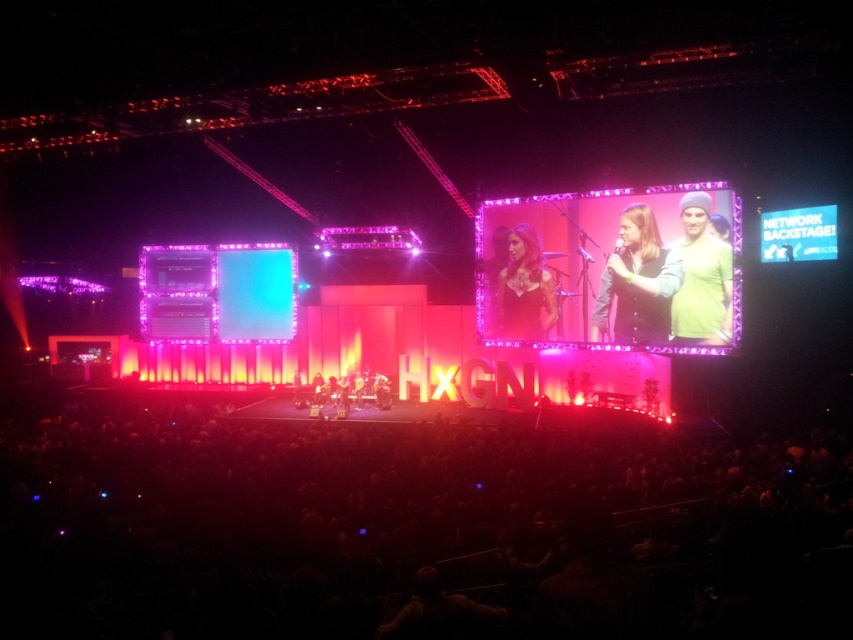
Question: Is green fabric jacket at upper right to the right of matte black dress at center from the viewer's perspective?

Choices:
 (A) yes
 (B) no

Answer: (A)

Question: Which of the following is the farthest from the observer?

Choices:
 (A) green fabric jacket at upper right
 (B) green knit beanie at upper right
 (C) matte black dress at center

Answer: (C)

Question: Does matte black dress at center appear on the left side of green knit beanie at upper right?

Choices:
 (A) yes
 (B) no

Answer: (A)

Question: Considering the real-world distances, which object is closest to the green fabric jacket at upper right?

Choices:
 (A) green knit beanie at upper right
 (B) matte black dress at center

Answer: (A)

Question: Does green fabric jacket at upper right have a larger size compared to matte black dress at center?

Choices:
 (A) yes
 (B) no

Answer: (B)

Question: Estimate the real-world distances between objects in this image. Which object is closer to the green fabric jacket at upper right?

Choices:
 (A) matte black dress at center
 (B) green knit beanie at upper right

Answer: (B)